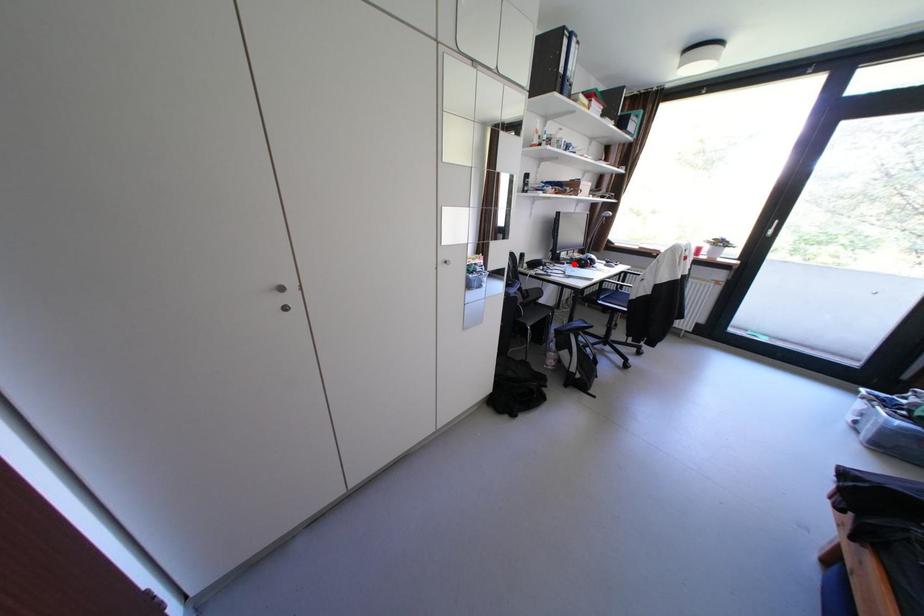
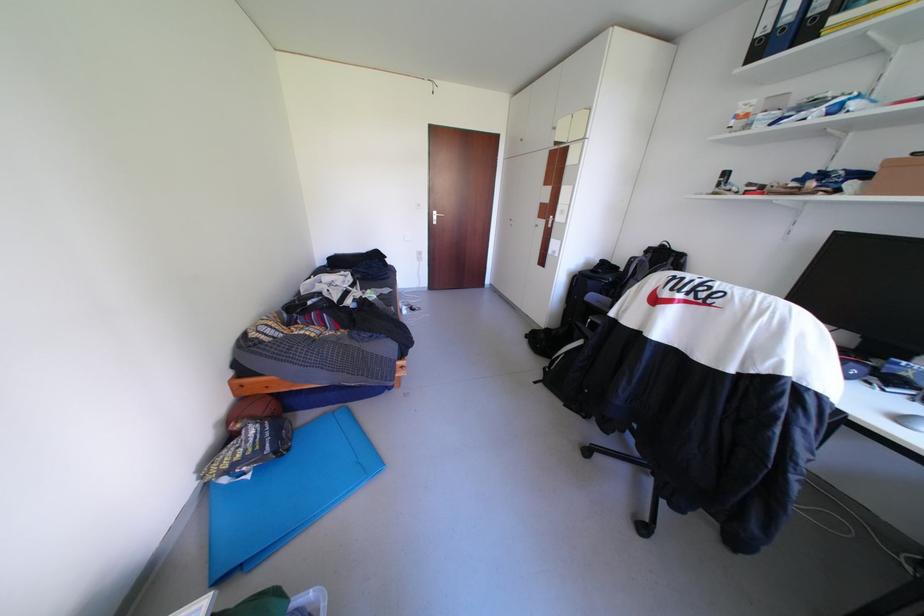
Question: I am providing you with two images of the same scene from different viewpoints. A red point is marked on the first image. At the location where the point appears in image 1, is it still visible in image 2?

Choices:
 (A) Yes
 (B) No

Answer: (B)